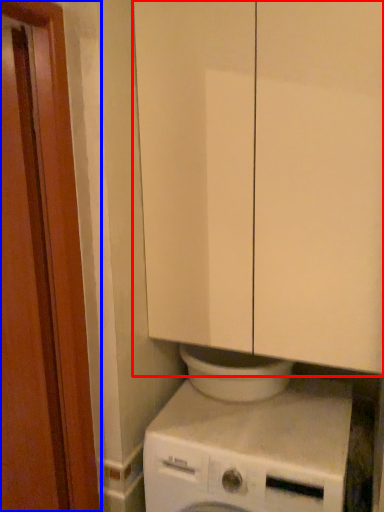
Question: Among these objects, which one is nearest to the camera, cabinetry (highlighted by a red box) or screen door (highlighted by a blue box)?

Choices:
 (A) cabinetry
 (B) screen door

Answer: (B)